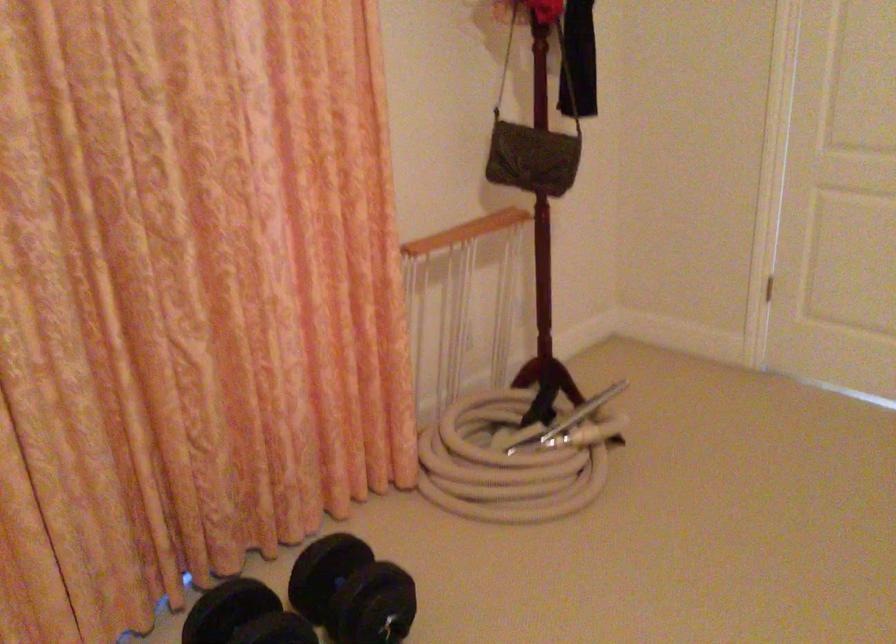
Locate an element on the screen. The width and height of the screenshot is (896, 644). white door handle is located at coordinates (762, 283).